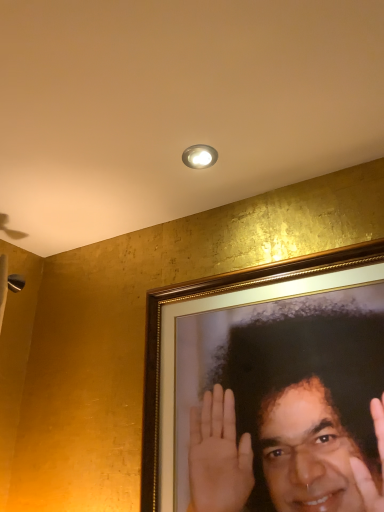
Question: Is matte silver light fixture at upper center inside or outside of smooth gold frame at upper right?

Choices:
 (A) outside
 (B) inside

Answer: (A)

Question: Relative to smooth gold frame at upper right, is matte silver light fixture at upper center in front or behind?

Choices:
 (A) front
 (B) behind

Answer: (B)

Question: Is matte silver light fixture at upper center wider or thinner than smooth gold frame at upper right?

Choices:
 (A) wide
 (B) thin

Answer: (A)

Question: Would you say smooth gold frame at upper right is inside or outside matte silver light fixture at upper center?

Choices:
 (A) outside
 (B) inside

Answer: (A)

Question: Visually, is smooth gold frame at upper right positioned to the left or to the right of matte silver light fixture at upper center?

Choices:
 (A) right
 (B) left

Answer: (A)

Question: Considering the positions of smooth gold frame at upper right and matte silver light fixture at upper center in the image, is smooth gold frame at upper right taller or shorter than matte silver light fixture at upper center?

Choices:
 (A) tall
 (B) short

Answer: (A)

Question: Looking at their shapes, would you say smooth gold frame at upper right is wider or thinner than matte silver light fixture at upper center?

Choices:
 (A) thin
 (B) wide

Answer: (A)